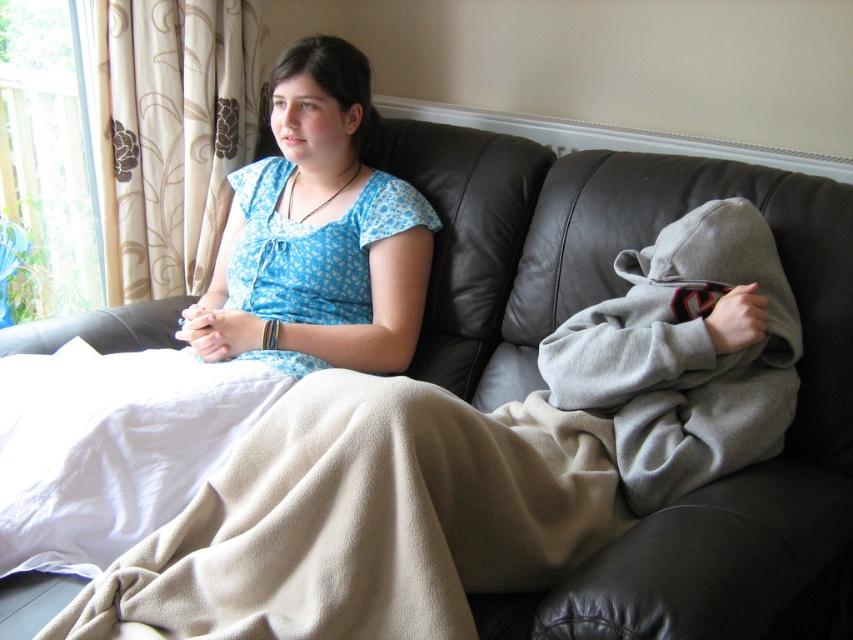
Is blue printed fabric at center wider than beige fleece blanket at lower left?

Indeed, blue printed fabric at center has a greater width compared to beige fleece blanket at lower left.

Measure the distance between point (206, 307) and camera.

A distance of 1.62 meters exists between point (206, 307) and camera.

Locate an element on the screen. The width and height of the screenshot is (853, 640). blue printed fabric at center is located at coordinates (318, 232).

Does blue cotton shirt at upper center have a larger size compared to beige fleece blanket at lower left?

Yes.

Which of these two, blue cotton shirt at upper center or beige fleece blanket at lower left, stands shorter?

With less height is beige fleece blanket at lower left.

Based on the photo, who is more forward, [51,496] or [144,500]?

Point [51,496]

Identify the location of blue cotton shirt at upper center. This screenshot has width=853, height=640. (223, 332).

Can you confirm if blue cotton shirt at upper center is wider than blue printed fabric at center?

Yes.

Between point (193, 352) and point (350, 96), which one is positioned in front?

Point (193, 352)

Is point (244, 230) positioned behind point (340, 250)?

Yes.

What are the coordinates of `blue cotton shirt at upper center` in the screenshot? It's located at (223, 332).